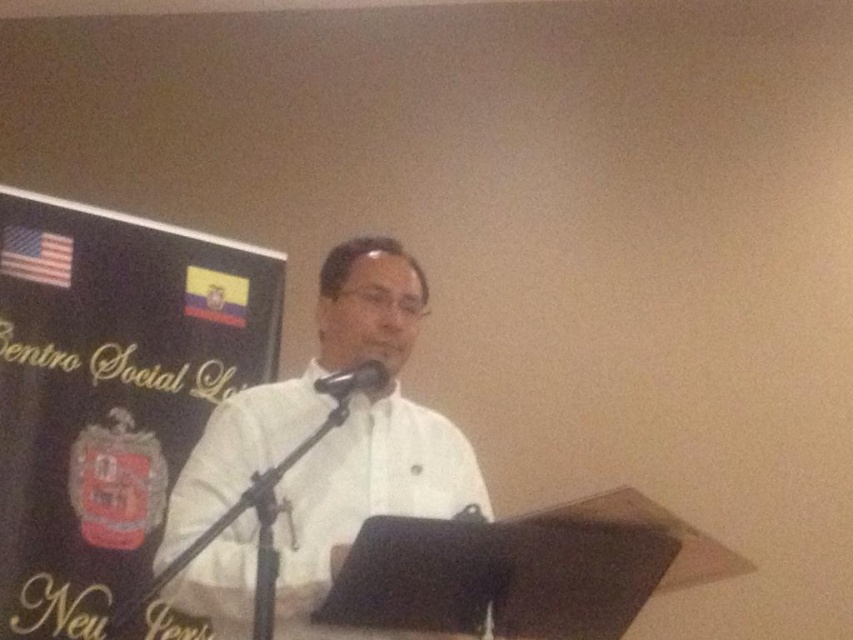
Does point (41, 593) come closer to viewer compared to point (378, 362)?

No, it is not.

Is point (234, 296) in front of point (343, 371)?

That is False.

Image resolution: width=853 pixels, height=640 pixels. Find the location of `black fabric at left`. black fabric at left is located at coordinates (109, 392).

Does black fabric at left appear on the right side of white glossy shirt at center?

No, black fabric at left is not to the right of white glossy shirt at center.

Which is in front, point (49, 330) or point (372, 506)?

Point (372, 506) is in front.

Which is behind, point (105, 589) or point (178, 577)?

Positioned behind is point (105, 589).

The height and width of the screenshot is (640, 853). In order to click on black fabric at left in this screenshot , I will do `click(109, 392)`.

Is point (393, 388) farther from viewer compared to point (363, 364)?

Yes, point (393, 388) is behind point (363, 364).

Does white glossy shirt at center have a smaller size compared to black matte microphone at center?

Actually, white glossy shirt at center might be larger than black matte microphone at center.

Does point (202, 580) lie in front of point (341, 372)?

Yes, point (202, 580) is closer to viewer.

Locate an element on the screen. This screenshot has width=853, height=640. white glossy shirt at center is located at coordinates (334, 433).